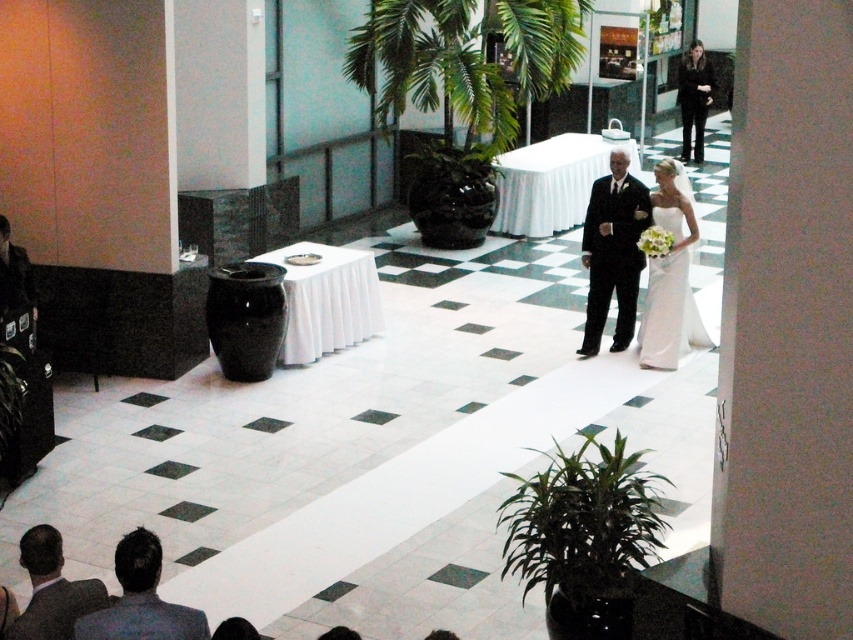
Question: Can you confirm if gray suit at lower left is positioned to the left of dark gray suit at lower left?

Choices:
 (A) no
 (B) yes

Answer: (A)

Question: Which is farther from the matte black suit at center?

Choices:
 (A) gray suit at lower left
 (B) white satin dress at center
 (C) dark gray suit at lower left

Answer: (C)

Question: Is matte black suit at center thinner than white satin dress at center?

Choices:
 (A) yes
 (B) no

Answer: (A)

Question: Is matte black suit at center positioned before gray suit at lower left?

Choices:
 (A) no
 (B) yes

Answer: (A)

Question: Which object is closer to the camera taking this photo?

Choices:
 (A) gray suit at lower left
 (B) white satin dress at center

Answer: (A)

Question: Which point is farther to the camera?

Choices:
 (A) (27, 556)
 (B) (587, 212)
 (C) (689, 212)

Answer: (B)